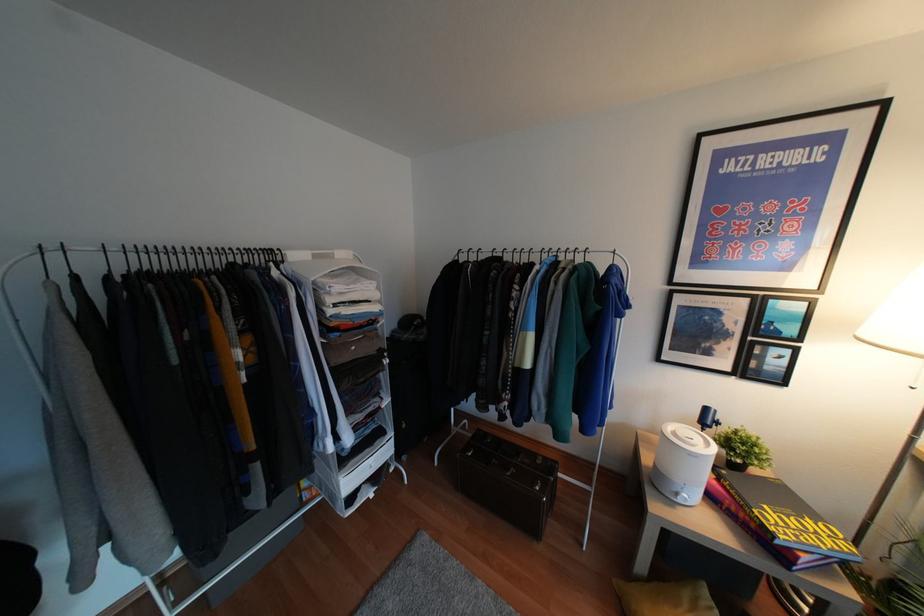
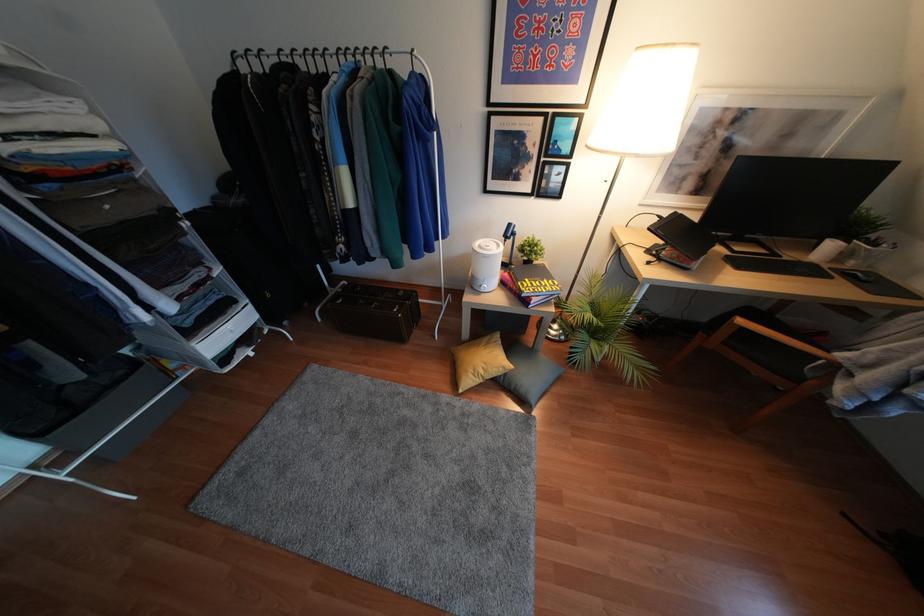
In the second image, find the point that corresponds to point 543,254 in the first image.

(342, 59)